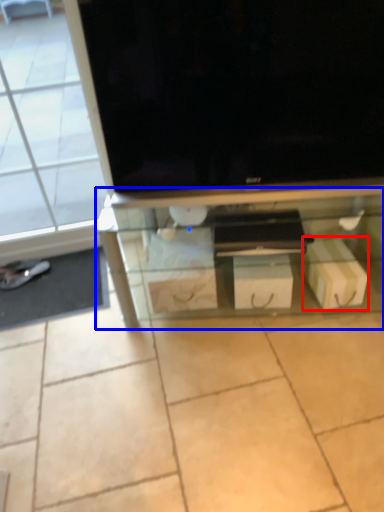
Question: Which object appears closest to the camera in this image, cardboard box (highlighted by a red box) or shelf (highlighted by a blue box)?

Choices:
 (A) cardboard box
 (B) shelf

Answer: (B)